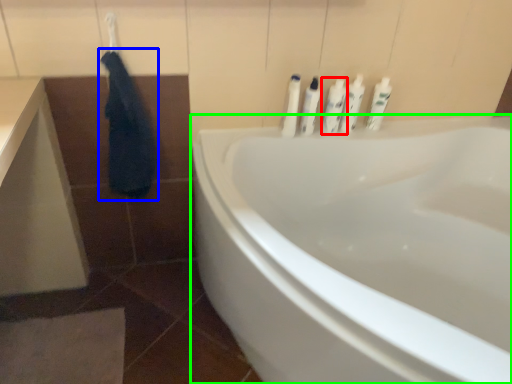
Question: Which object is positioned closest to toiletry (highlighted by a red box)? Select from robe (highlighted by a blue box) and bathtub (highlighted by a green box).

Choices:
 (A) robe
 (B) bathtub

Answer: (B)